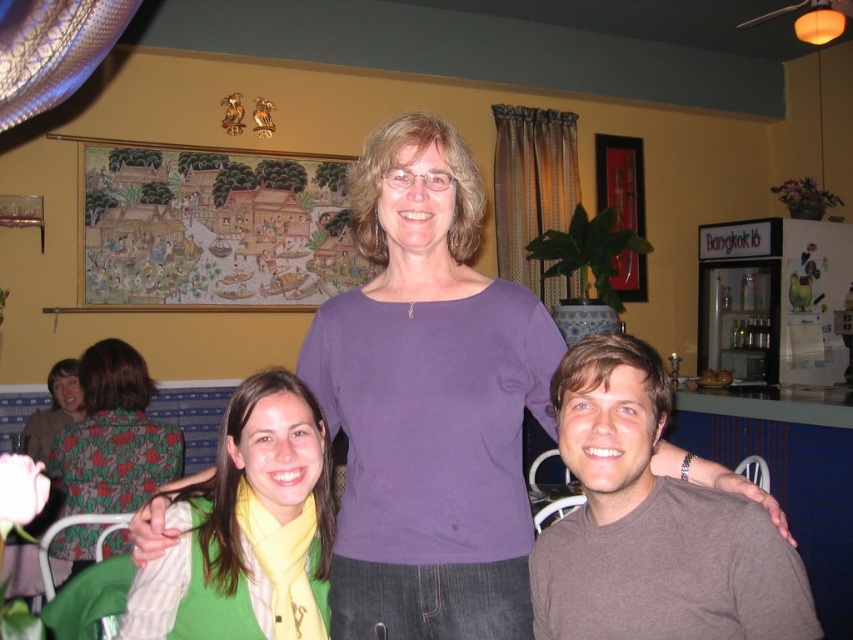
You are a photographer trying to adjust the lighting for a group photo. You notice the purple smooth shirt at center and the floral fabric dress at left. Which clothing item would cast a larger shadow if the light source is directly above them?

The purple smooth shirt at center is larger in size than the floral fabric dress at left, so it would cast a larger shadow.

You are a photographer trying to adjust the camera angle to ensure both the purple smooth shirt at center and the floral fabric dress at left are clearly visible in the photo. Given their heights, which one might you need to position closer to the camera to avoid being obscured?

The purple smooth shirt at center is much taller than the floral fabric dress at left, so positioning the floral fabric dress at left closer to the camera would help ensure it isn t obscured by the taller purple smooth shirt at center.